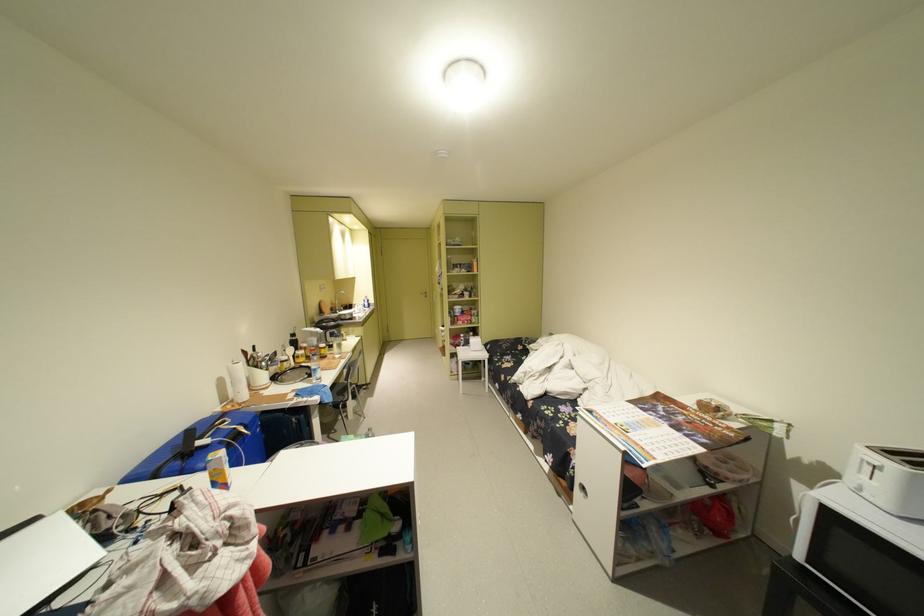
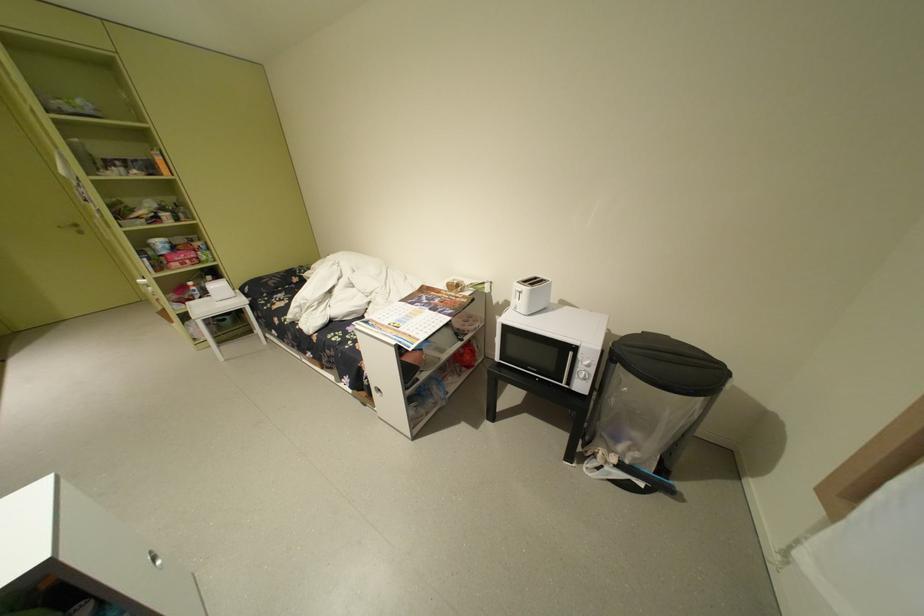
The point at (473, 338) is marked in the first image. Where is the corresponding point in the second image?

(204, 286)